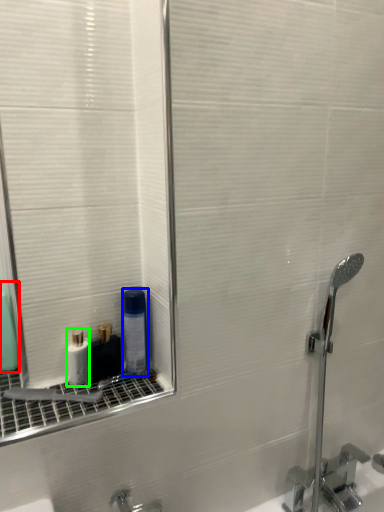
Question: Which is farther away from mouthwash (highlighted by a red box)? mouthwash (highlighted by a blue box) or mouthwash (highlighted by a green box)?

Choices:
 (A) mouthwash
 (B) mouthwash

Answer: (A)